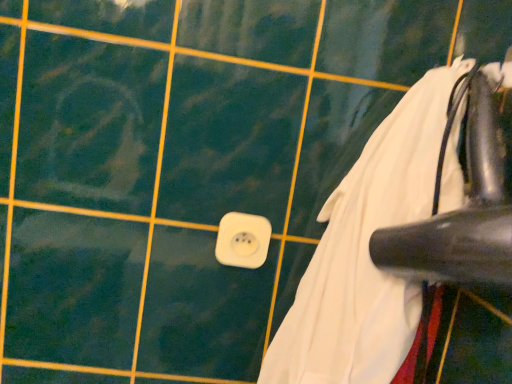
Question: From a real-world perspective, is white plastic socket at center positioned over white fabric at lower right based on gravity?

Choices:
 (A) no
 (B) yes

Answer: (A)

Question: Does white plastic socket at center appear on the left side of white fabric at lower right?

Choices:
 (A) no
 (B) yes

Answer: (B)

Question: Is white plastic socket at center aimed at white fabric at lower right?

Choices:
 (A) yes
 (B) no

Answer: (B)

Question: From the image's perspective, is white plastic socket at center over white fabric at lower right?

Choices:
 (A) no
 (B) yes

Answer: (A)

Question: Does white plastic socket at center have a lesser height compared to white fabric at lower right?

Choices:
 (A) yes
 (B) no

Answer: (A)

Question: From a real-world perspective, is white plastic socket at center beneath white fabric at lower right?

Choices:
 (A) no
 (B) yes

Answer: (B)

Question: From a real-world perspective, is white fabric at lower right located higher than white plastic socket at center?

Choices:
 (A) no
 (B) yes

Answer: (B)

Question: Is white fabric at lower right to the right of white plastic socket at center from the viewer's perspective?

Choices:
 (A) no
 (B) yes

Answer: (B)

Question: Considering the relative sizes of white fabric at lower right and white plastic socket at center in the image provided, is white fabric at lower right thinner than white plastic socket at center?

Choices:
 (A) no
 (B) yes

Answer: (A)

Question: Is white fabric at lower right in contact with white plastic socket at center?

Choices:
 (A) no
 (B) yes

Answer: (A)

Question: From the image's perspective, is white fabric at lower right located above white plastic socket at center?

Choices:
 (A) yes
 (B) no

Answer: (A)

Question: Is white fabric at lower right wider than white plastic socket at center?

Choices:
 (A) yes
 (B) no

Answer: (A)

Question: From a real-world perspective, is white plastic socket at center physically located above or below white fabric at lower right?

Choices:
 (A) below
 (B) above

Answer: (A)